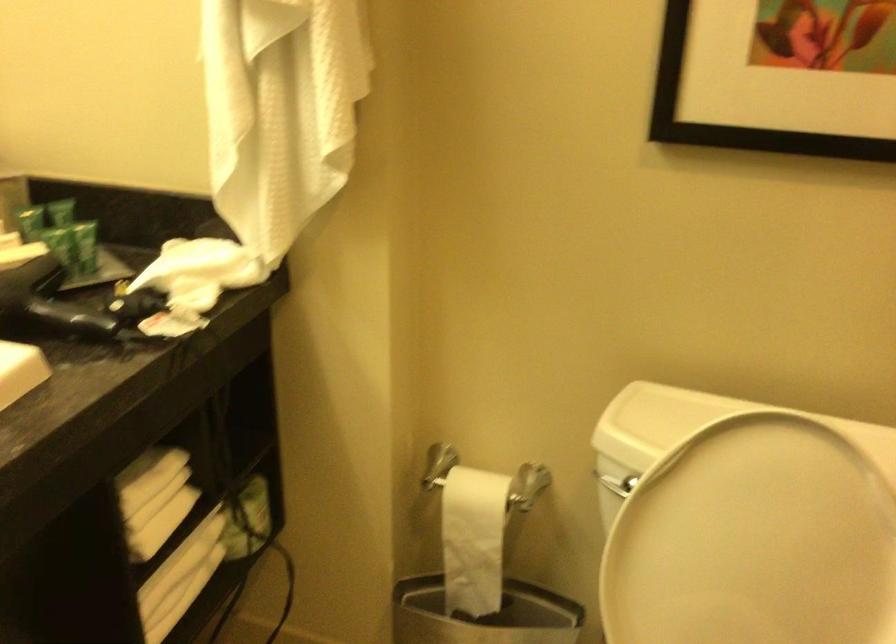
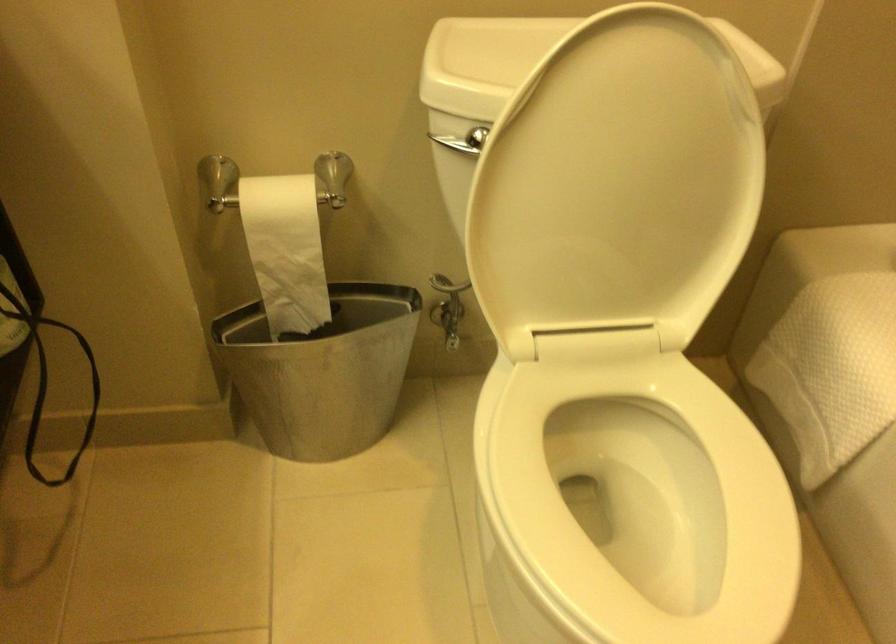
Find the pixel in the second image that matches the point at 754,561 in the first image.

(617, 183)